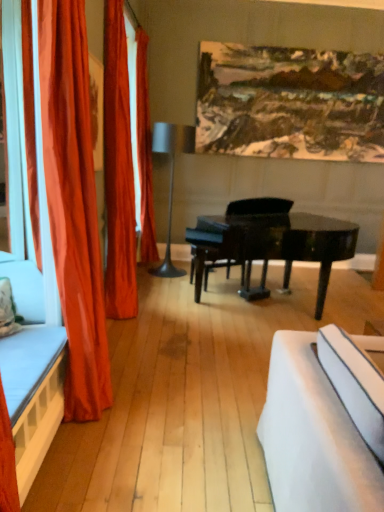
Where is `vacant area located to the right-hand side of satin orange curtain at left, which ranks as the 1th curtain in front-to-back order`? The image size is (384, 512). vacant area located to the right-hand side of satin orange curtain at left, which ranks as the 1th curtain in front-to-back order is located at coordinates (157, 407).